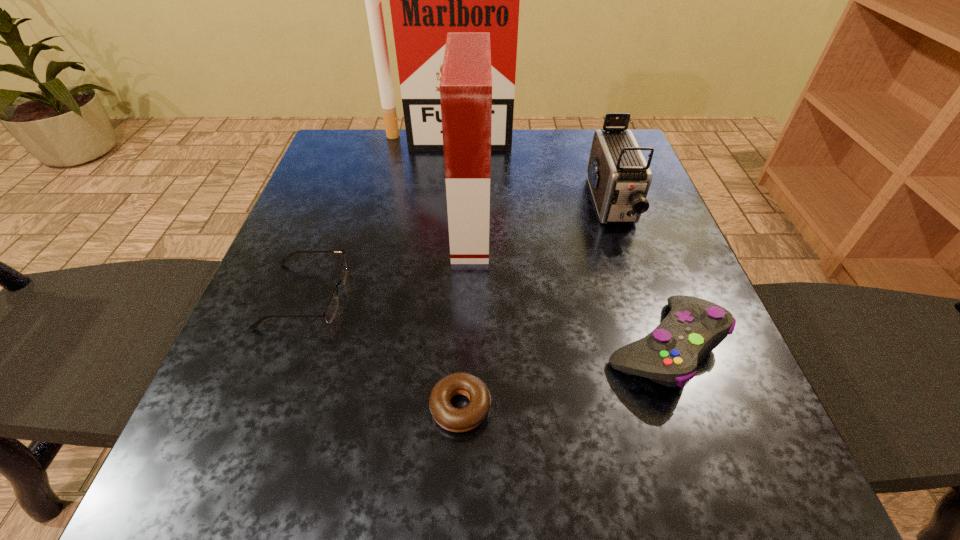
Identify the location of unoccupied position between the spectacles and the nearer cigarette_case. The width and height of the screenshot is (960, 540). (388, 261).

Locate which object is the fourth closest to the nearer cigarette_case. Please provide its 2D coordinates. Your answer should be formatted as a tuple, i.e. [(x, y)], where the tuple contains the x and y coordinates of a point satisfying the conditions above.

[(619, 177)]

At what (x,y) coordinates should I click in order to perform the action: click on object that is the third closest to the nearer cigarette_case. Please return your answer as a coordinate pair (x, y). Looking at the image, I should click on (669, 355).

Find the location of a particular element. This screenshot has width=960, height=540. vacant area that satisfies the following two spatial constraints: 1. on the front-facing side of the fourth tallest object; 2. on the left side of the farthest object is located at coordinates (427, 346).

Locate an element on the screen. This screenshot has width=960, height=540. free space that satisfies the following two spatial constraints: 1. on the front-facing side of the farthest object; 2. on the left side of the doughnut is located at coordinates (420, 407).

Image resolution: width=960 pixels, height=540 pixels. I want to click on free space that satisfies the following two spatial constraints: 1. on the front-facing side of the control; 2. on the left side of the farthest object, so (427, 346).

Locate an element on the screen. This screenshot has width=960, height=540. vacant area that satisfies the following two spatial constraints: 1. at the lens of the third tallest object; 2. on the front-facing side of the second shortest object is located at coordinates (641, 295).

Identify the location of vacant region that satisfies the following two spatial constraints: 1. on the front-facing side of the nearer cigarette_case; 2. on the front side of the shortest object. The image size is (960, 540). (467, 407).

Image resolution: width=960 pixels, height=540 pixels. Find the location of `free space that satisfies the following two spatial constraints: 1. at the lens of the third tallest object; 2. on the front-facing side of the second shortest object`. free space that satisfies the following two spatial constraints: 1. at the lens of the third tallest object; 2. on the front-facing side of the second shortest object is located at coordinates (641, 295).